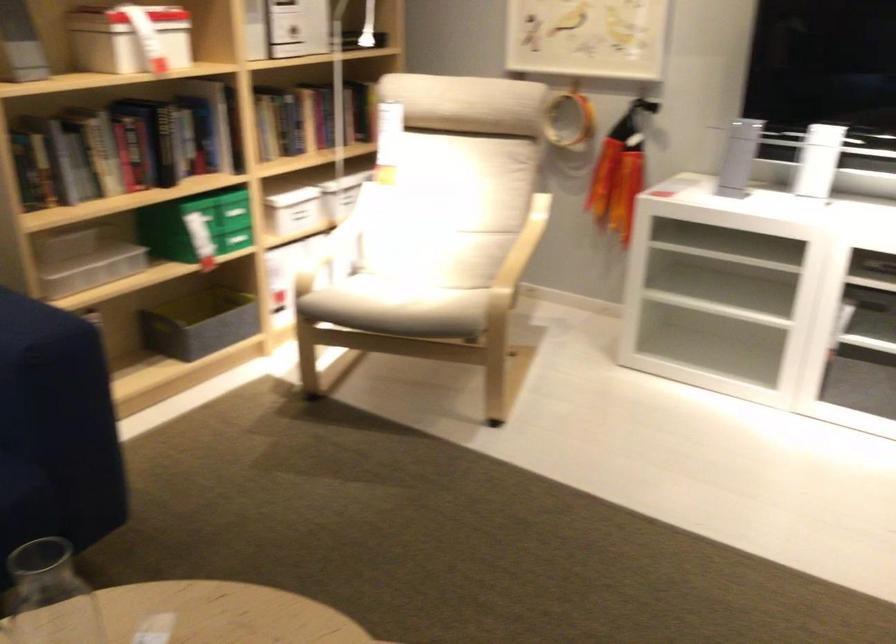
The height and width of the screenshot is (644, 896). In order to click on chair sitting surface in this screenshot , I will do `click(377, 292)`.